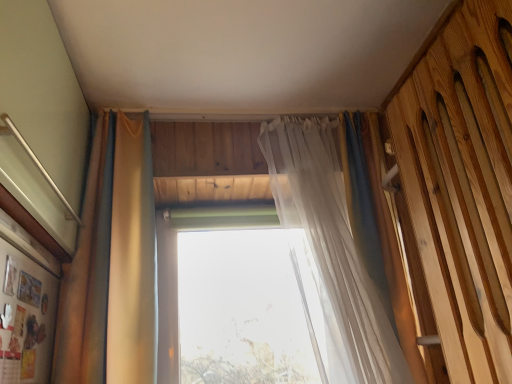
Question: Which direction should I rotate to look at translucent fabric curtain at center, placed as the 1th curtain when sorted from right to left, — up or down?

Choices:
 (A) up
 (B) down

Answer: (B)

Question: Can you confirm if transparent glass window at center is positioned to the left of wooden slats bed at right?

Choices:
 (A) yes
 (B) no

Answer: (A)

Question: Is transparent glass window at center smaller than wooden slats bed at right?

Choices:
 (A) no
 (B) yes

Answer: (B)

Question: Does transparent glass window at center lie behind wooden slats bed at right?

Choices:
 (A) no
 (B) yes

Answer: (B)

Question: Does transparent glass window at center turn towards wooden slats bed at right?

Choices:
 (A) yes
 (B) no

Answer: (B)

Question: Is transparent glass window at center positioned with its back to wooden slats bed at right?

Choices:
 (A) yes
 (B) no

Answer: (B)

Question: Is transparent glass window at center closer to camera compared to wooden slats bed at right?

Choices:
 (A) no
 (B) yes

Answer: (A)

Question: Can you confirm if matte gold curtain at left, placed as the first curtain when sorted from left to right, is bigger than wooden slats bed at right?

Choices:
 (A) yes
 (B) no

Answer: (B)

Question: Are matte gold curtain at left, which is the 2th curtain from right to left, and wooden slats bed at right located far from each other?

Choices:
 (A) no
 (B) yes

Answer: (A)

Question: Does matte gold curtain at left, which is the 2th curtain from right to left, lie behind wooden slats bed at right?

Choices:
 (A) yes
 (B) no

Answer: (A)

Question: From a real-world perspective, does matte gold curtain at left, placed as the first curtain when sorted from left to right, stand above wooden slats bed at right?

Choices:
 (A) no
 (B) yes

Answer: (B)

Question: Can you confirm if matte gold curtain at left, placed as the first curtain when sorted from left to right, is shorter than wooden slats bed at right?

Choices:
 (A) yes
 (B) no

Answer: (B)

Question: From a real-world perspective, is matte gold curtain at left, placed as the first curtain when sorted from left to right, beneath wooden slats bed at right?

Choices:
 (A) yes
 (B) no

Answer: (B)

Question: Could you tell me if matte gold curtain at left, which is the 2th curtain from right to left, is facing translucent fabric curtain at center, positioned as the second curtain in left-to-right order?

Choices:
 (A) yes
 (B) no

Answer: (B)